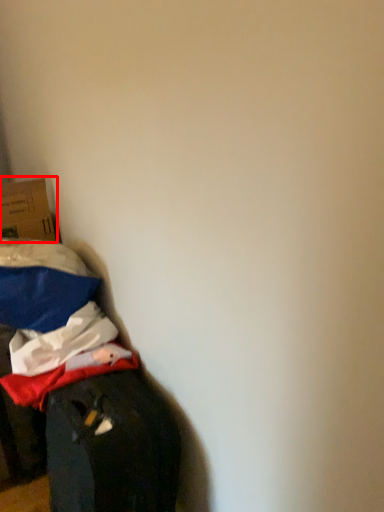
Question: From the image's perspective, what is the correct spatial positioning of box (annotated by the red box) in reference to furniture?

Choices:
 (A) above
 (B) below

Answer: (A)